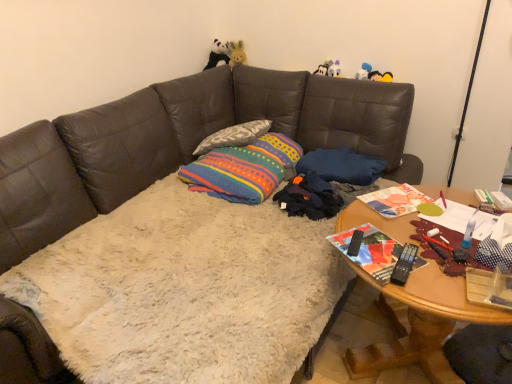
Question: Should I look upward or downward to see black plush panda at upper center?

Choices:
 (A) down
 (B) up

Answer: (B)

Question: Which direction should I rotate to face blue fabric pillow at center, the first pillow when ordered from right to left, — up or down?

Choices:
 (A) down
 (B) up

Answer: (B)

Question: Does black plush panda at upper center have a smaller size compared to textured gray pillow at center, placed as the 2th pillow when sorted from right to left?

Choices:
 (A) yes
 (B) no

Answer: (A)

Question: Considering the relative sizes of black plush panda at upper center and textured gray pillow at center, the first pillow viewed from the left, in the image provided, is black plush panda at upper center bigger than textured gray pillow at center, the first pillow viewed from the left,?

Choices:
 (A) no
 (B) yes

Answer: (A)

Question: From the image's perspective, does black plush panda at upper center appear lower than textured gray pillow at center, placed as the 2th pillow when sorted from right to left?

Choices:
 (A) yes
 (B) no

Answer: (B)

Question: Can you confirm if black plush panda at upper center is wider than textured gray pillow at center, the first pillow viewed from the left?

Choices:
 (A) no
 (B) yes

Answer: (A)

Question: Is black plush panda at upper center placed right next to textured gray pillow at center, placed as the 2th pillow when sorted from right to left?

Choices:
 (A) yes
 (B) no

Answer: (B)

Question: From the image's perspective, is black plush panda at upper center on top of textured gray pillow at center, the first pillow viewed from the left?

Choices:
 (A) yes
 (B) no

Answer: (A)

Question: Is textured gray pillow at center, placed as the 2th pillow when sorted from right to left, looking in the opposite direction of black plush panda at upper center?

Choices:
 (A) no
 (B) yes

Answer: (A)

Question: From a real-world perspective, is textured gray pillow at center, placed as the 2th pillow when sorted from right to left, positioned under black plush panda at upper center based on gravity?

Choices:
 (A) no
 (B) yes

Answer: (B)

Question: From a real-world perspective, does textured gray pillow at center, placed as the 2th pillow when sorted from right to left, stand above black plush panda at upper center?

Choices:
 (A) no
 (B) yes

Answer: (A)

Question: Can you confirm if textured gray pillow at center, placed as the 2th pillow when sorted from right to left, is taller than black plush panda at upper center?

Choices:
 (A) yes
 (B) no

Answer: (B)

Question: Does textured gray pillow at center, the first pillow viewed from the left, have a lesser width compared to black plush panda at upper center?

Choices:
 (A) no
 (B) yes

Answer: (A)

Question: Is textured gray pillow at center, placed as the 2th pillow when sorted from right to left, to the right of black plush panda at upper center from the viewer's perspective?

Choices:
 (A) yes
 (B) no

Answer: (A)

Question: Is multicolored fabric throw pillow at center outside textured gray pillow at center, placed as the 2th pillow when sorted from right to left?

Choices:
 (A) no
 (B) yes

Answer: (B)